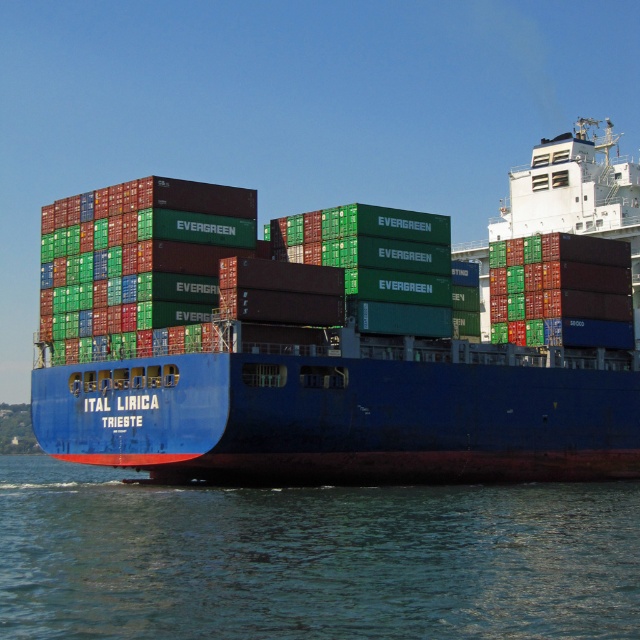
Question: Which of the following is the farthest from the observer?

Choices:
 (A) (579, 396)
 (B) (35, 515)

Answer: (A)

Question: Is blue matte container ship at center wider than blue water at lower center?

Choices:
 (A) no
 (B) yes

Answer: (B)

Question: Is blue matte container ship at center closer to the viewer compared to blue water at lower center?

Choices:
 (A) yes
 (B) no

Answer: (B)

Question: Does blue matte container ship at center appear on the left side of blue water at lower center?

Choices:
 (A) no
 (B) yes

Answer: (A)